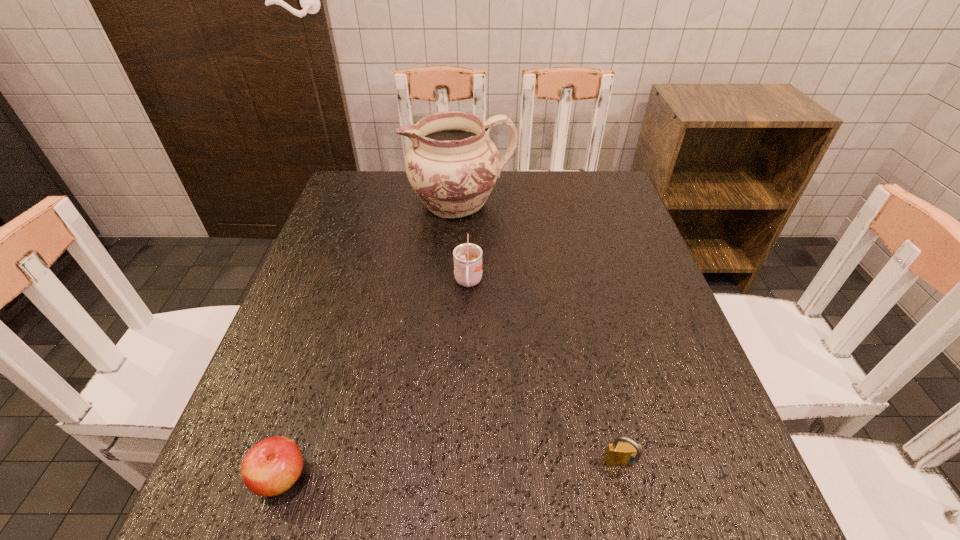
Find the location of `pitcher`. pitcher is located at coordinates 452,164.

Locate an element on the screen. The width and height of the screenshot is (960, 540). the farthest object is located at coordinates (452, 164).

Find the location of `the third nearest object`. the third nearest object is located at coordinates (467, 257).

The image size is (960, 540). Find the location of `the second tallest object`. the second tallest object is located at coordinates (467, 257).

The height and width of the screenshot is (540, 960). I want to click on padlock, so click(x=629, y=453).

Find the location of a particular element. apple is located at coordinates (273, 465).

This screenshot has height=540, width=960. I want to click on vacant space situated 0.110m on the spout of the tallest object, so click(368, 203).

At what (x,y) coordinates should I click in order to perform the action: click on vacant region located on the spout of the tallest object. Please return your answer as a coordinate pair (x, y). Image resolution: width=960 pixels, height=540 pixels. Looking at the image, I should click on (385, 203).

What are the coordinates of `free space located on the spout of the tallest object` in the screenshot? It's located at (344, 203).

Find the location of a particular element. This screenshot has height=540, width=960. free space located 0.140m on the side with the handle of the third shortest object is located at coordinates (467, 348).